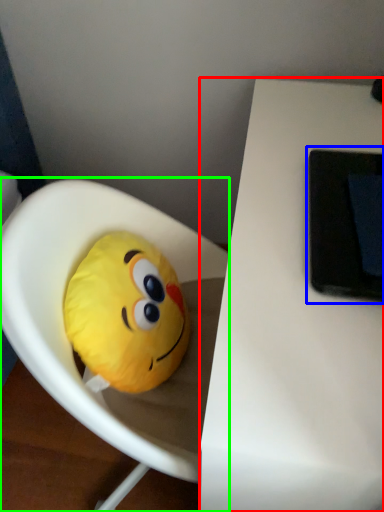
Question: Estimate the real-world distances between objects in this image. Which object is closer to table (highlighted by a red box), tablet computer (highlighted by a blue box) or toy (highlighted by a green box)?

Choices:
 (A) tablet computer
 (B) toy

Answer: (A)